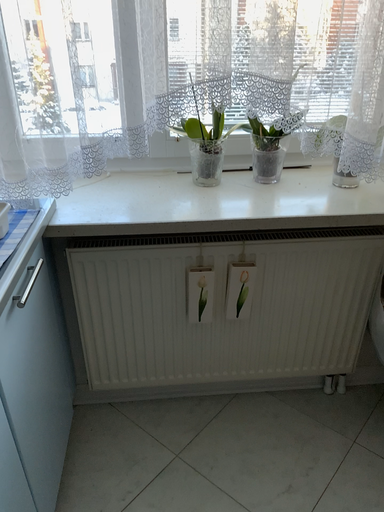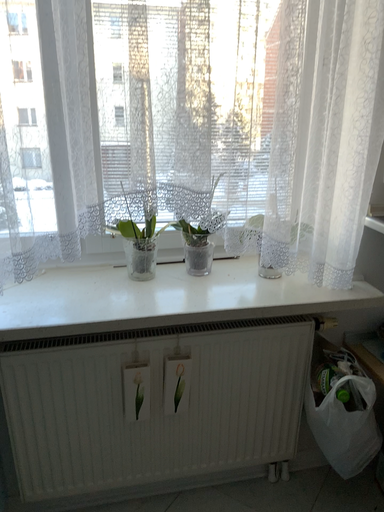
Question: Which way did the camera rotate in the video?

Choices:
 (A) rotated right
 (B) rotated left

Answer: (A)